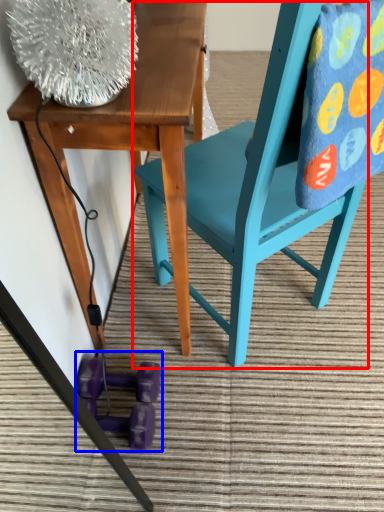
Question: Which object appears farthest to the camera in this image, chair (highlighted by a red box) or toy (highlighted by a blue box)?

Choices:
 (A) chair
 (B) toy

Answer: (B)